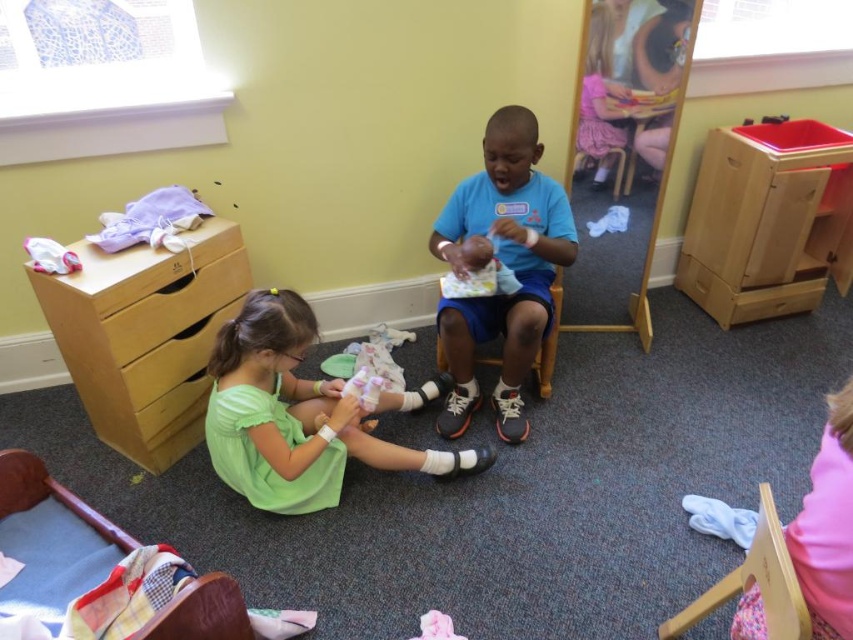
You are a parent trying to organize toys in the playroom. You have a small box that can only hold items shorter than the blue matte shirt at center. Can the green fabric doll at lower center fit inside the box?

The green fabric doll at lower center has a lesser height compared to the blue matte shirt at center, so it can fit inside the box since it is shorter than the required height limit.

You are a parent trying to store a green fabric doll at lower center in a wooden drawer at right. Can the doll fit inside the drawer?

The wooden drawer at right has a lesser width compared to green fabric doll at lower center, so the doll will not fit inside the drawer.